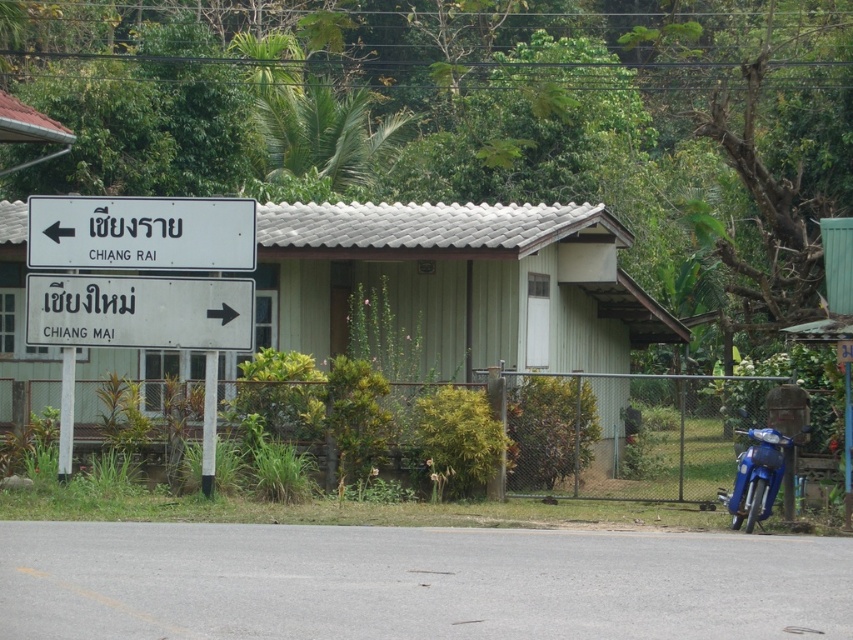
You are standing at the entrance of the building and want to check the distance between the white matte sign at center and the white plastic pole at left. According to the scene, how far apart are they?

The white matte sign at center is 34.41 inches from the white plastic pole at left.

You are a traveler standing in front of the green wood hut at center and the white plastic sign at left. Which object would you say is larger in size?

The white plastic sign at left is larger in size than the green wood hut at center.